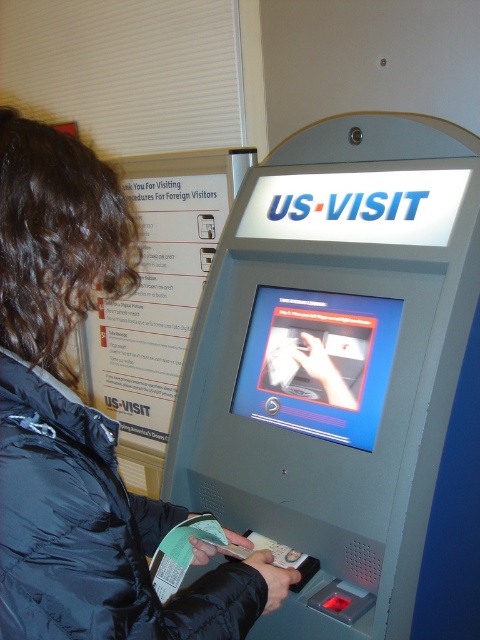
Question: Is gray metallic kiosk at center closer to camera compared to black matte jacket at center?

Choices:
 (A) no
 (B) yes

Answer: (A)

Question: Which is nearer to the black puffy jacket at center?

Choices:
 (A) black matte jacket at center
 (B) gray metallic kiosk at center

Answer: (A)

Question: Which object is the farthest from the black puffy jacket at center?

Choices:
 (A) gray metallic kiosk at center
 (B) black matte jacket at center

Answer: (A)

Question: Which point is closer to the camera?

Choices:
 (A) pyautogui.click(x=43, y=300)
 (B) pyautogui.click(x=337, y=616)
 (C) pyautogui.click(x=91, y=563)

Answer: (C)

Question: Is gray metallic kiosk at center thinner than black puffy jacket at center?

Choices:
 (A) no
 (B) yes

Answer: (A)

Question: Considering the relative positions of gray metallic kiosk at center and black matte jacket at center in the image provided, where is gray metallic kiosk at center located with respect to black matte jacket at center?

Choices:
 (A) right
 (B) left

Answer: (A)